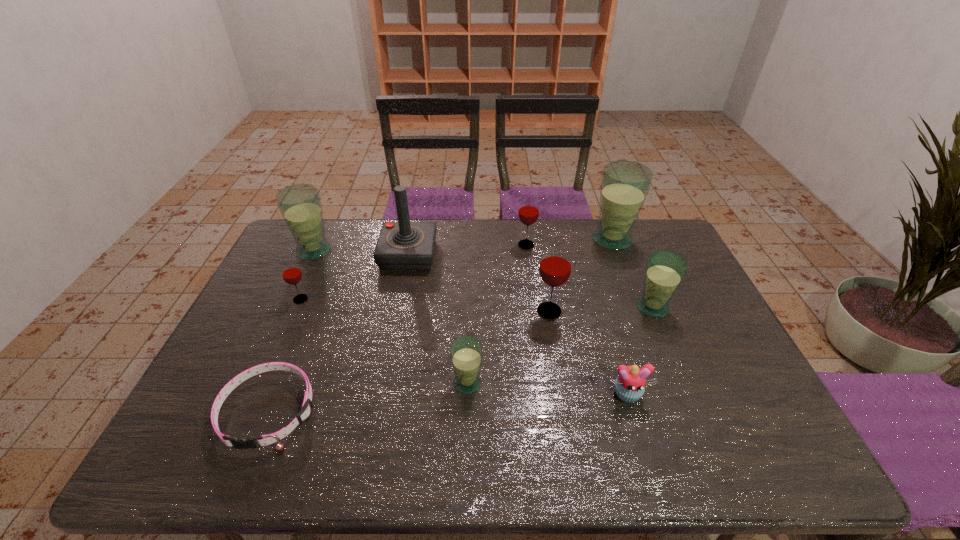
You are a GUI agent. You are given a task and a screenshot of the screen. Output one action in this format:
    pyautogui.click(x=<x>, y=<y>)
    Task: Click on the free space between the tallest glass and the biggest red glass
    The width and height of the screenshot is (960, 540).
    Given the screenshot: What is the action you would take?
    (581, 275)

The height and width of the screenshot is (540, 960). What are the coordinates of `vacant space in between the leftmost blue glass and the tallest glass` in the screenshot? It's located at (463, 245).

The width and height of the screenshot is (960, 540). I want to click on object that stands as the second closest to the dog collar, so click(x=466, y=352).

Identify which object is the fifth nearest to the joystick. Please provide its 2D coordinates. Your answer should be formatted as a tuple, i.e. [(x, y)], where the tuple contains the x and y coordinates of a point satisfying the conditions above.

[(466, 352)]

Locate which glass ranks fifth in proximity to the farthest red glass. Please provide its 2D coordinates. Your answer should be formatted as a tuple, i.e. [(x, y)], where the tuple contains the x and y coordinates of a point satisfying the conditions above.

[(300, 205)]

This screenshot has width=960, height=540. I want to click on glass that can be found as the fourth closest to the second smallest red glass, so click(466, 352).

Point out which blue glass is positioned as the third nearest to the smallest red glass. Please provide its 2D coordinates. Your answer should be formatted as a tuple, i.e. [(x, y)], where the tuple contains the x and y coordinates of a point satisfying the conditions above.

[(625, 185)]

You are a GUI agent. You are given a task and a screenshot of the screen. Output one action in this format:
    pyautogui.click(x=<x>, y=<y>)
    Task: Click on the blue glass object that ranks as the second closest to the tallest glass
    Image resolution: width=960 pixels, height=540 pixels.
    Given the screenshot: What is the action you would take?
    pyautogui.click(x=466, y=352)

The width and height of the screenshot is (960, 540). I want to click on red glass that is the closest to the tallest glass, so click(528, 213).

Identify which red glass is the nearest to the biggest red glass. Please provide its 2D coordinates. Your answer should be formatted as a tuple, i.e. [(x, y)], where the tuple contains the x and y coordinates of a point satisfying the conditions above.

[(528, 213)]